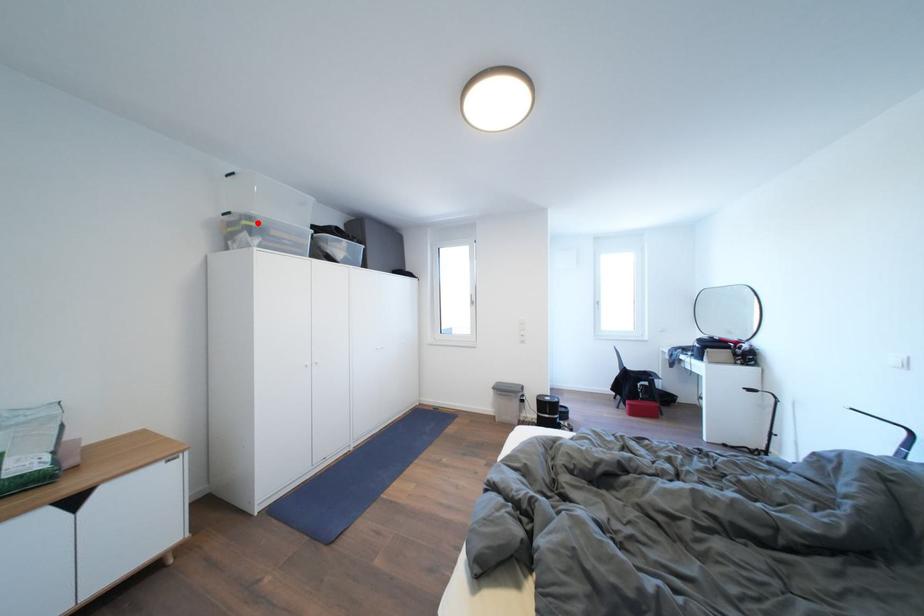
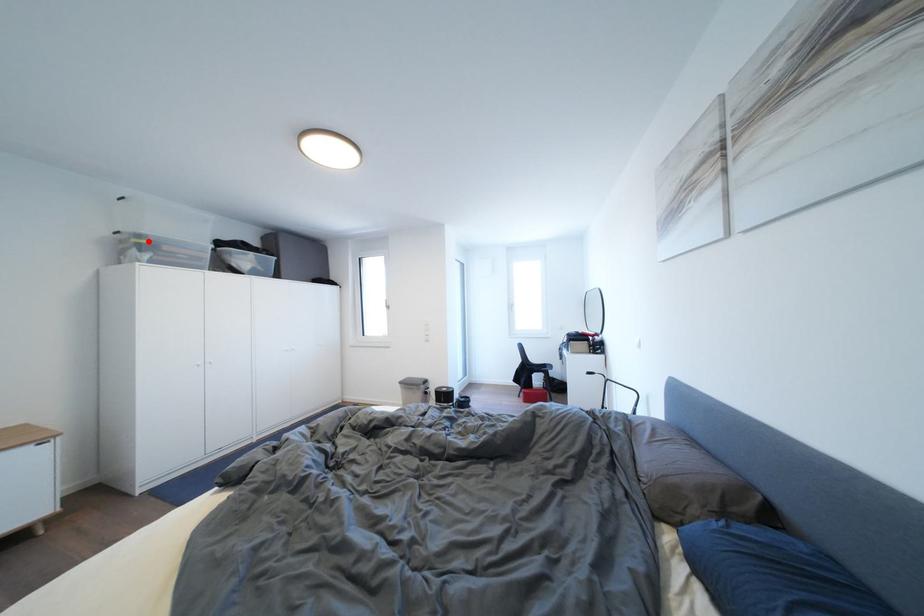
I am providing you with two images of the same scene from different viewpoints. A red point is marked on the first image and another point is marked on the second image. Do the highlighted points in image1 and image2 indicate the same real-world spot?

Yes